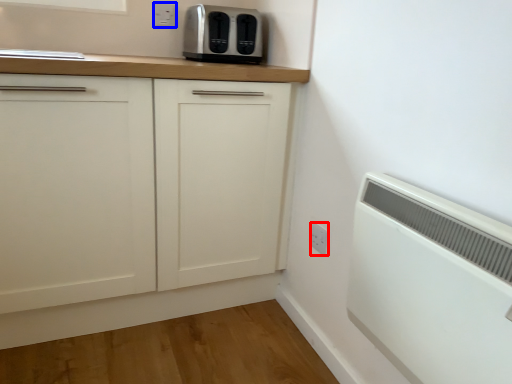
Question: Among these objects, which one is nearest to the camera, electric outlet (highlighted by a red box) or electric outlet (highlighted by a blue box)?

Choices:
 (A) electric outlet
 (B) electric outlet

Answer: (A)